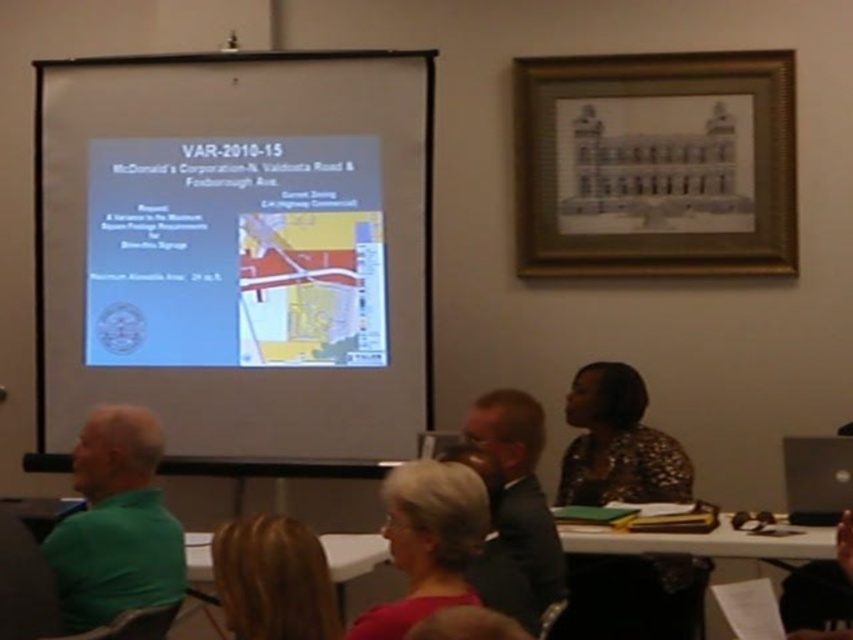
Does matte white projector screen at upper center appear on the right side of black plastic laptop at lower right?

In fact, matte white projector screen at upper center is to the left of black plastic laptop at lower right.

Who is more forward, [161,168] or [790,513]?

Point [790,513] is in front.

Where is `matte white projector screen at upper center`? This screenshot has width=853, height=640. matte white projector screen at upper center is located at coordinates (235, 252).

Between gold-framed drawing at upper center and green matte shirt at left, which one appears on the right side from the viewer's perspective?

Positioned to the right is gold-framed drawing at upper center.

Who is lower down, gold-framed drawing at upper center or green matte shirt at left?

green matte shirt at left is below.

Locate an element on the screen. The image size is (853, 640). gold-framed drawing at upper center is located at coordinates (656, 164).

The width and height of the screenshot is (853, 640). Identify the location of gold-framed drawing at upper center. (656, 164).

Is white matte projection screen at upper center closer to the viewer compared to green matte shirt at left?

No.

Is point (265, 81) farther from camera compared to point (93, 529)?

Yes, point (265, 81) is behind point (93, 529).

Locate an element on the screen. white matte projection screen at upper center is located at coordinates (238, 252).